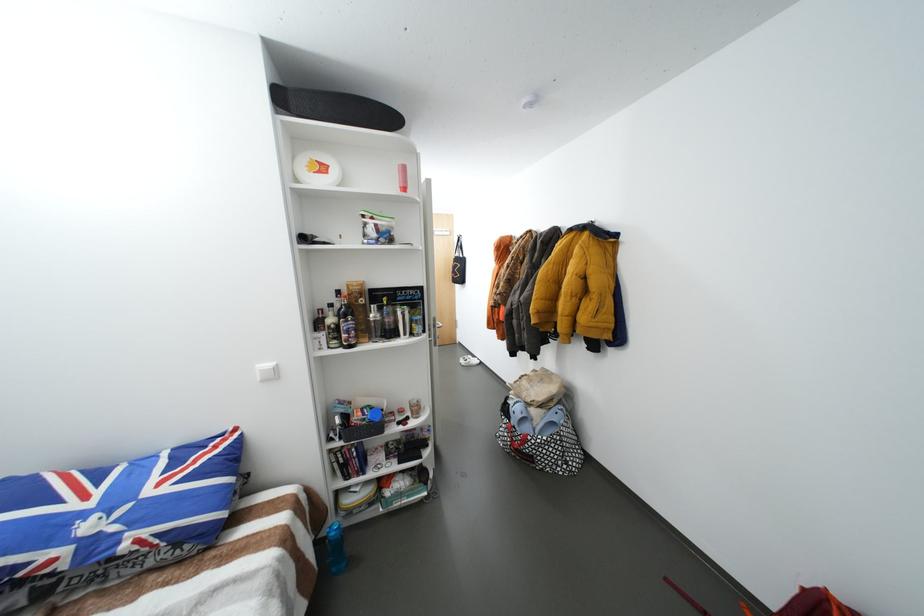
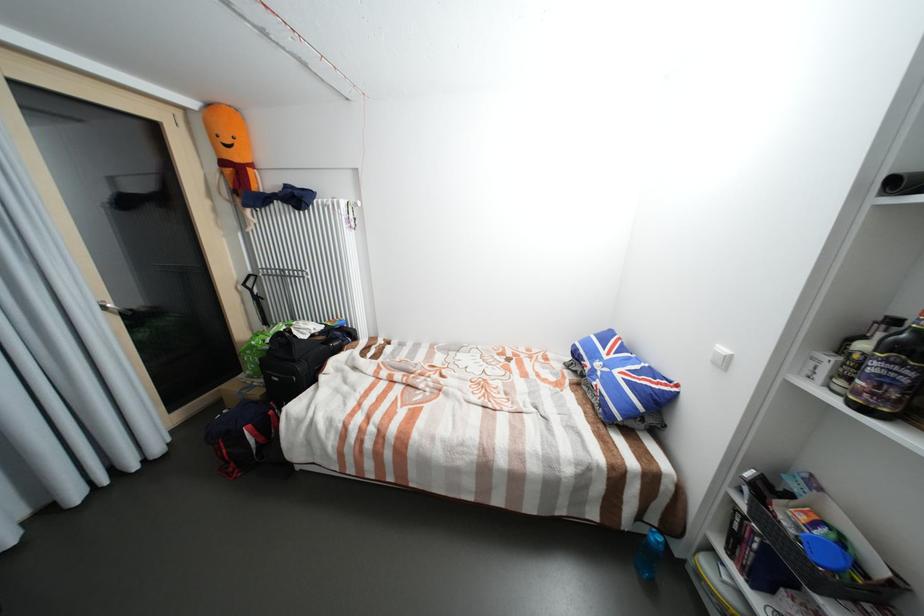
The point at (x=98, y=505) is marked in the first image. Where is the corresponding point in the second image?

(613, 358)